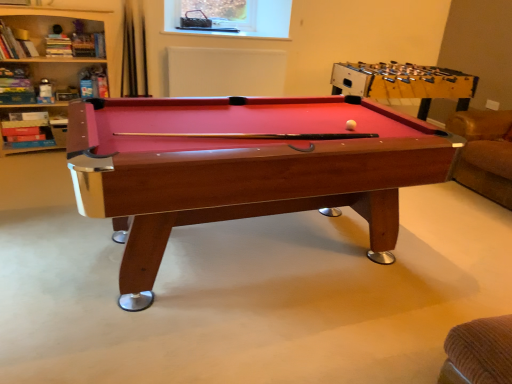
Question: In terms of width, does yellow matte ball at center look wider or thinner when compared to wooden bookshelf at upper left?

Choices:
 (A) wide
 (B) thin

Answer: (B)

Question: Does point (349, 127) appear closer or farther from the camera than point (38, 59)?

Choices:
 (A) farther
 (B) closer

Answer: (B)

Question: Considering the real-world distances, which object is closest to the yellow matte ball at center?

Choices:
 (A) rubberized red pool table at upper right
 (B) wooden billiard table at center
 (C) wooden bookshelf at upper left

Answer: (B)

Question: Which of these objects is positioned farthest from the rubberized red pool table at upper right?

Choices:
 (A) wooden billiard table at center
 (B) yellow matte ball at center
 (C) wooden bookshelf at upper left

Answer: (C)